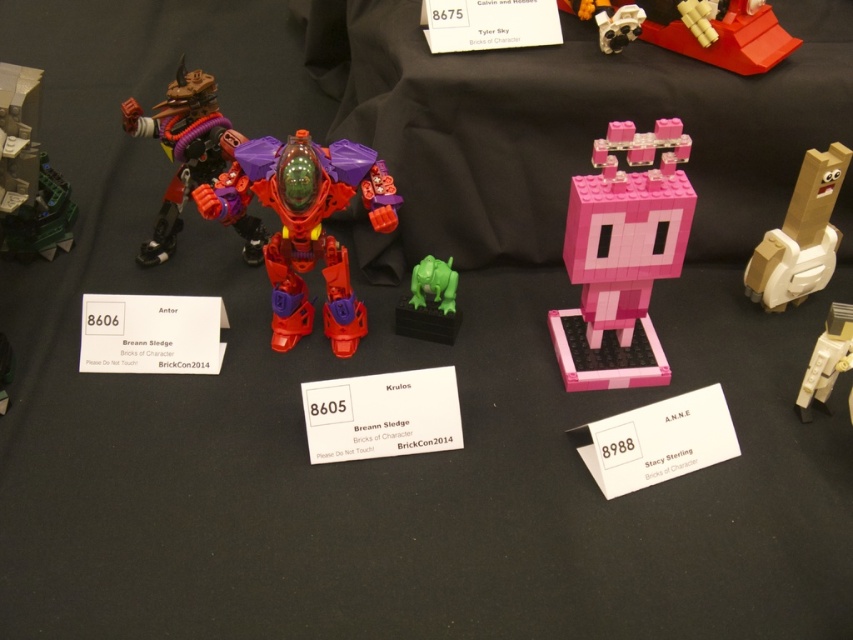
Question: Which point is closer to the camera taking this photo?

Choices:
 (A) (1, 76)
 (B) (814, 170)

Answer: (B)

Question: Is pink matte piggy bank at center bigger than matte black and purple robot at left?

Choices:
 (A) no
 (B) yes

Answer: (B)

Question: Which of the following is the farthest from the observer?

Choices:
 (A) brick-like red robot at upper right
 (B) pink matte blocky figure at center
 (C) matte plastic robot at center
 (D) matte black and purple robot at left

Answer: (A)

Question: Is the position of pink matte blocky figure at center less distant than that of white plastic robot at right?

Choices:
 (A) no
 (B) yes

Answer: (B)

Question: Is pink matte piggy bank at center below matte plastic robot at center?

Choices:
 (A) no
 (B) yes

Answer: (A)

Question: Which point is closer to the camera?

Choices:
 (A) white plastic robot at right
 (B) matte black and purple robot at left

Answer: (A)